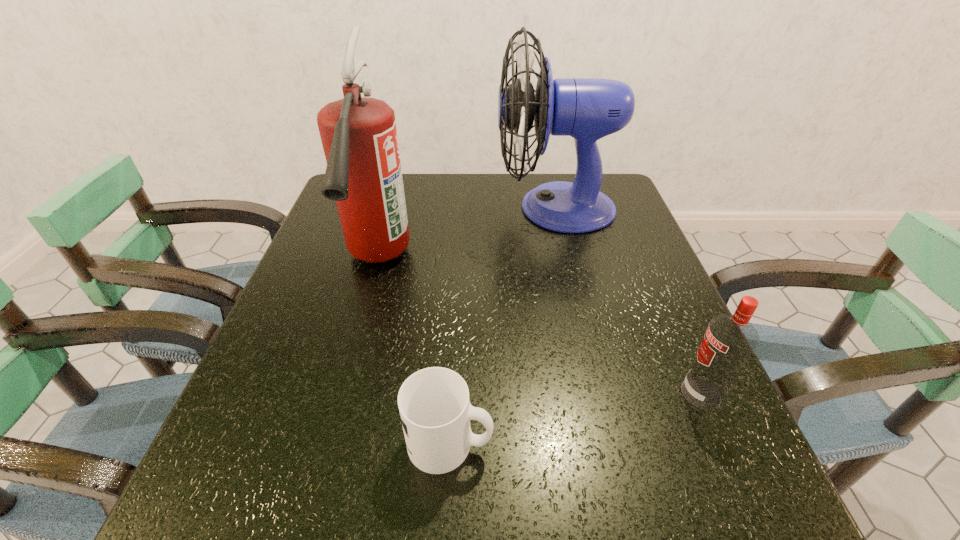
The image size is (960, 540). In order to click on free area in between the fan and the fire extinguisher in this screenshot , I will do `click(467, 235)`.

This screenshot has width=960, height=540. In order to click on free space that is in between the fan and the second object from left to right in this screenshot , I will do `click(503, 326)`.

The image size is (960, 540). What are the coordinates of `vacant area that lies between the vodka and the fire extinguisher` in the screenshot? It's located at (539, 327).

This screenshot has width=960, height=540. I want to click on free spot between the nearest object and the fire extinguisher, so click(x=414, y=352).

Locate an element on the screen. free spot between the leftmost object and the third farthest object is located at coordinates (539, 327).

Locate which object ranks in proximity to the nearest object. Please provide its 2D coordinates. Your answer should be formatted as a tuple, i.e. [(x, y)], where the tuple contains the x and y coordinates of a point satisfying the conditions above.

[(363, 175)]

Select which object appears as the closest to the fan. Please provide its 2D coordinates. Your answer should be formatted as a tuple, i.e. [(x, y)], where the tuple contains the x and y coordinates of a point satisfying the conditions above.

[(363, 175)]

Locate an element on the screen. The width and height of the screenshot is (960, 540). free region that satisfies the following two spatial constraints: 1. in front of the fan where the airflow is directed; 2. at the nozzle of the fire extinguisher is located at coordinates (568, 261).

Where is `blank area in the image that satisfies the following two spatial constraints: 1. in front of the fan where the airflow is directed; 2. at the nozzle of the leftmost object`? This screenshot has width=960, height=540. blank area in the image that satisfies the following two spatial constraints: 1. in front of the fan where the airflow is directed; 2. at the nozzle of the leftmost object is located at coordinates (568, 261).